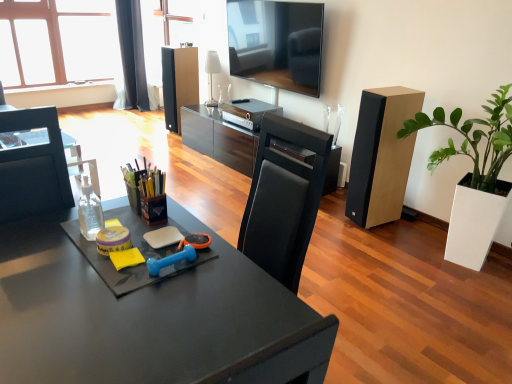
Question: Considering their positions, is white glossy lamp at upper center located in front of or behind green matte plant at right?

Choices:
 (A) behind
 (B) front

Answer: (A)

Question: Based on their sizes in the image, would you say white glossy lamp at upper center is bigger or smaller than green matte plant at right?

Choices:
 (A) small
 (B) big

Answer: (A)

Question: Estimate the real-world distances between objects in this image. Which object is closer to the matte black desk at center?

Choices:
 (A) matte black speaker at center, placed as the second speaker when sorted from front to back
 (B) green matte plant at right
 (C) clear plastic bottle at left
 (D) clear glass window at upper left
 (E) black fabric curtain at upper left

Answer: (C)

Question: Which object is positioned closest to the clear plastic bottle at left?

Choices:
 (A) matte black speaker at center, which is the 2th speaker from bottom to top
 (B) white glossy lamp at upper center
 (C) matte black desk at center
 (D) black fabric curtain at upper left
 (E) green matte plant at right

Answer: (C)